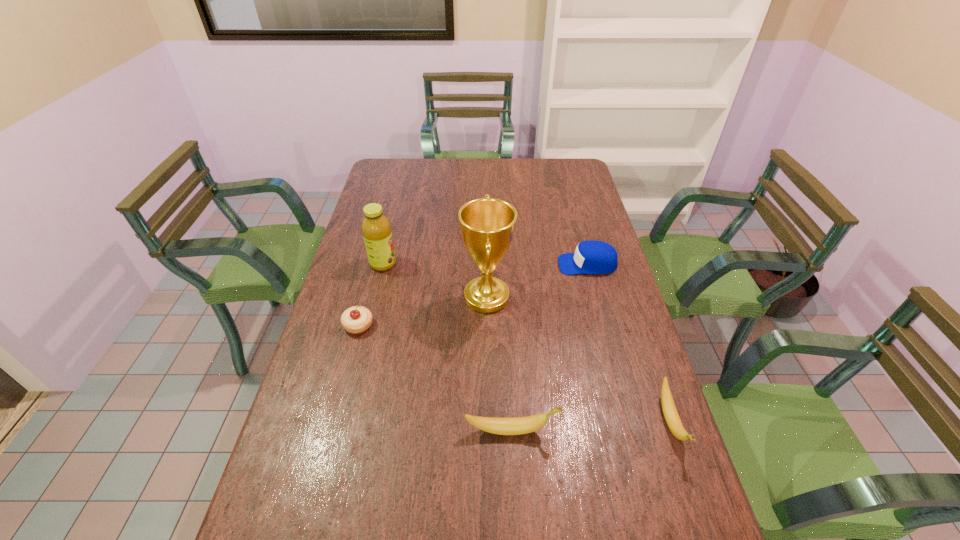
Find the location of a particular element. The image size is (960, 540). the fourth shortest object is located at coordinates 519,425.

The height and width of the screenshot is (540, 960). In order to click on the left banana in this screenshot , I will do `click(519, 425)`.

Locate an element on the screen. The width and height of the screenshot is (960, 540). the shorter banana is located at coordinates (672, 418).

Where is `baseball cap`? The width and height of the screenshot is (960, 540). baseball cap is located at coordinates (591, 257).

In order to click on the tallest object in this screenshot , I will do `click(487, 225)`.

Where is `pastry`? The width and height of the screenshot is (960, 540). pastry is located at coordinates (357, 319).

Find the location of `the fifth shortest object`. the fifth shortest object is located at coordinates (376, 228).

Where is `blank area located at the stem of the taller banana`? blank area located at the stem of the taller banana is located at coordinates (663, 430).

Locate an element on the screen. free space located on the front-facing side of the baseball cap is located at coordinates (509, 265).

Identify the location of blank area located on the front-facing side of the baseball cap. (448, 265).